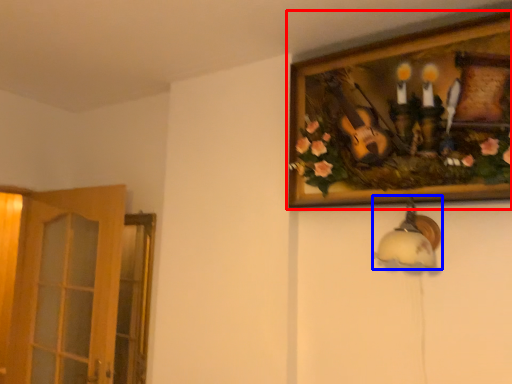
Question: Which object is further to the camera taking this photo, picture frame (highlighted by a red box) or lamp (highlighted by a blue box)?

Choices:
 (A) picture frame
 (B) lamp

Answer: (B)